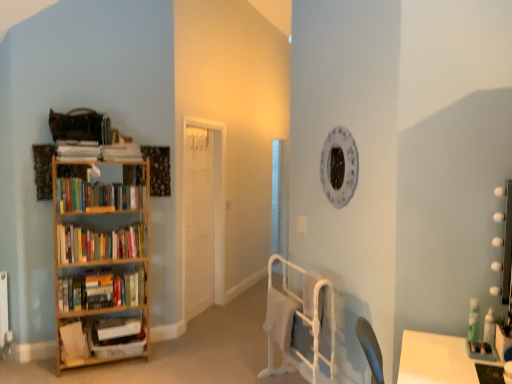
Find the location of a particular element. free location to the right of wooden bookshelf at left is located at coordinates (162, 364).